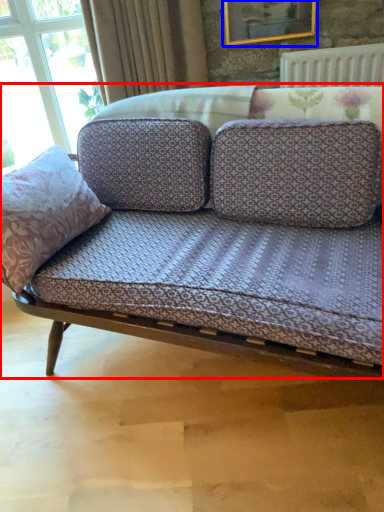
Question: Which point is closer to the camera, studio couch (highlighted by a red box) or picture frame (highlighted by a blue box)?

Choices:
 (A) studio couch
 (B) picture frame

Answer: (A)